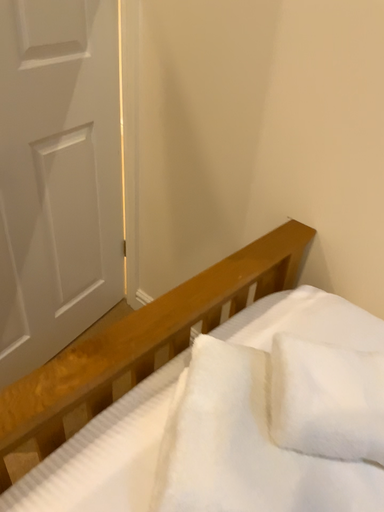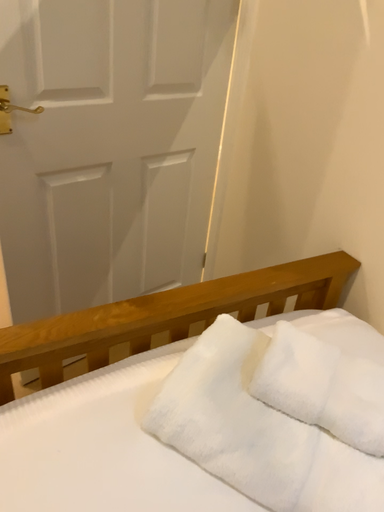
Question: Which way did the camera rotate in the video?

Choices:
 (A) rotated upward
 (B) rotated downward

Answer: (A)